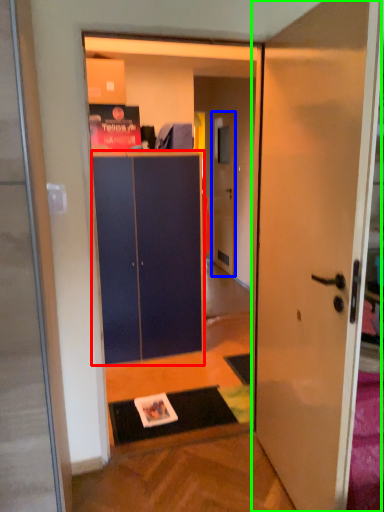
Question: Based on their relative distances, which object is nearer to cabinetry (highlighted by a red box)? Choose from door (highlighted by a blue box) and door (highlighted by a green box).

Choices:
 (A) door
 (B) door

Answer: (B)